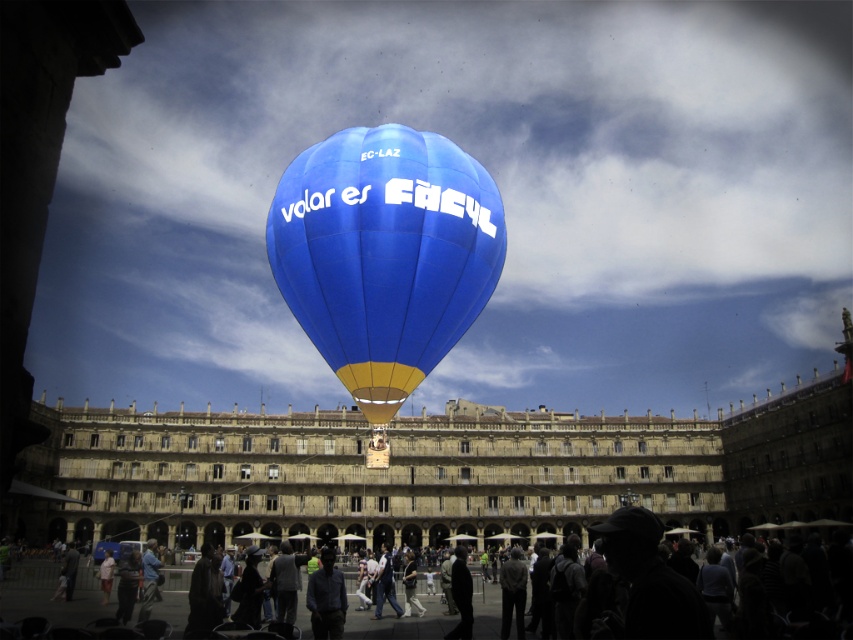
Does dark blue jeans at center appear on the left side of light brown fabric shirt at lower left?

No, dark blue jeans at center is not to the left of light brown fabric shirt at lower left.

Is dark blue jeans at center bigger than light brown fabric shirt at lower left?

Yes, dark blue jeans at center is bigger than light brown fabric shirt at lower left.

Identify the location of dark blue jeans at center. (386, 582).

Between blue fabric balloon at center and silhouette clothing at lower center, which one appears on the left side from the viewer's perspective?

blue fabric balloon at center

Identify the location of blue fabric balloon at center. Image resolution: width=853 pixels, height=640 pixels. (384, 253).

Does blue fabric balloon at center have a larger size compared to dark gray fabric shirt at center?

Yes, blue fabric balloon at center is bigger than dark gray fabric shirt at center.

Is point (450, 148) behind point (325, 588)?

No, (450, 148) is in front of (325, 588).

Find the location of a particular element. This screenshot has height=640, width=853. blue fabric balloon at center is located at coordinates (384, 253).